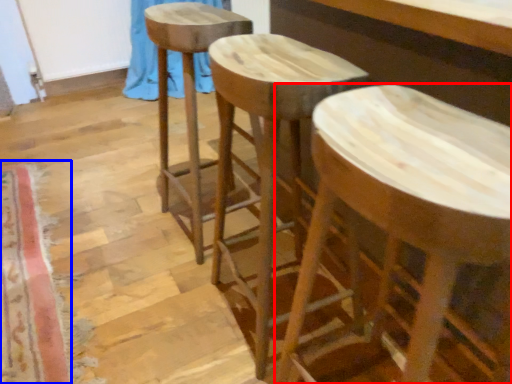
Question: Which of the following is the closest to the observer, stool (highlighted by a red box) or mat (highlighted by a blue box)?

Choices:
 (A) stool
 (B) mat

Answer: (A)